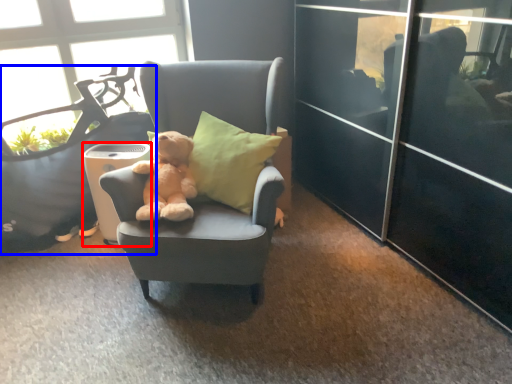
Question: Which point is closer to the camera, trash bin/can (highlighted by a red box) or chair (highlighted by a blue box)?

Choices:
 (A) trash bin/can
 (B) chair

Answer: (B)